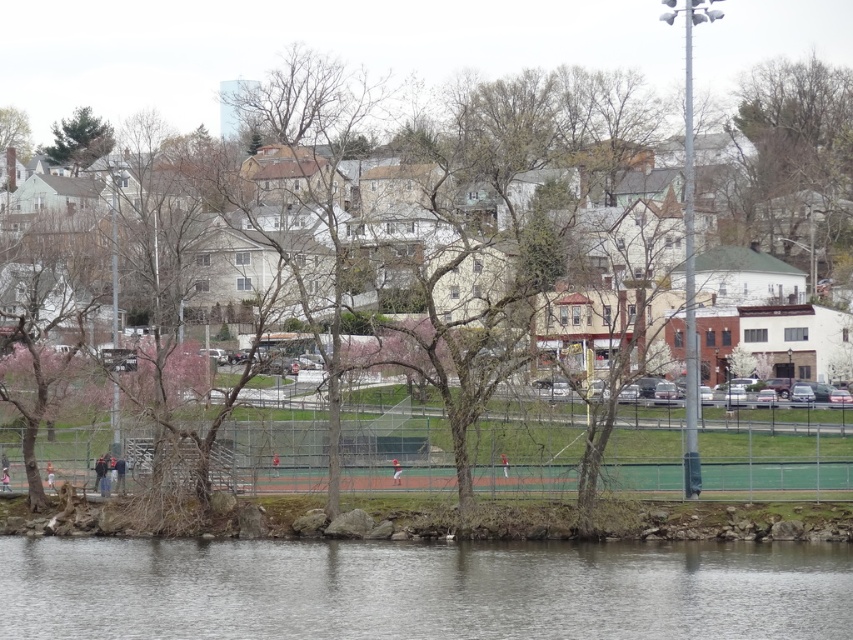
Which is more to the left, green leafy tree at upper left or matte baseball uniform at center?

green leafy tree at upper left

Can you confirm if green leafy tree at upper left is wider than matte baseball uniform at center?

Yes, green leafy tree at upper left is wider than matte baseball uniform at center.

Does point (51, 150) come farther from viewer compared to point (393, 468)?

Yes, point (51, 150) is behind point (393, 468).

Locate an element on the screen. The width and height of the screenshot is (853, 640). green leafy tree at upper left is located at coordinates (79, 140).

Can you confirm if gray smooth water at lower center is wider than red fabric person at lower left?

Correct, the width of gray smooth water at lower center exceeds that of red fabric person at lower left.

Does gray smooth water at lower center have a lesser height compared to red fabric person at lower left?

No, gray smooth water at lower center is not shorter than red fabric person at lower left.

Is point (93, 630) behind point (53, 474)?

No, (93, 630) is in front of (53, 474).

The width and height of the screenshot is (853, 640). Identify the location of gray smooth water at lower center. (419, 589).

Between gray smooth water at lower center and red fabric person at center, which one appears on the right side from the viewer's perspective?

Positioned to the right is red fabric person at center.

Is gray smooth water at lower center positioned at the back of red fabric person at center?

No, it is not.

Between point (697, 557) and point (503, 472), which one is positioned behind?

Point (503, 472)

Find the location of `gray smooth water at lower center`. gray smooth water at lower center is located at coordinates (419, 589).